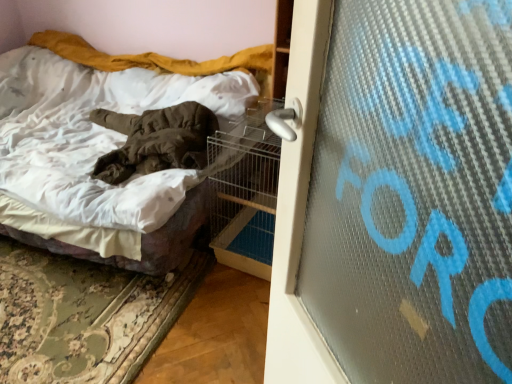
Question: From a real-world perspective, is white cotton bed at center positioned above or below metal wire birdcage at center?

Choices:
 (A) above
 (B) below

Answer: (A)

Question: Is point (90, 139) positioned closer to the camera than point (209, 168)?

Choices:
 (A) farther
 (B) closer

Answer: (A)

Question: Would you say white cotton bed at center is inside or outside metal wire birdcage at center?

Choices:
 (A) outside
 (B) inside

Answer: (A)

Question: Is metal wire birdcage at center taller or shorter than white cotton bed at center?

Choices:
 (A) short
 (B) tall

Answer: (B)

Question: From the image's perspective, is metal wire birdcage at center above or below white cotton bed at center?

Choices:
 (A) below
 (B) above

Answer: (A)

Question: Relative to white cotton bed at center, is metal wire birdcage at center in front or behind?

Choices:
 (A) front
 (B) behind

Answer: (B)

Question: Would you say metal wire birdcage at center is to the left or to the right of white cotton bed at center in the picture?

Choices:
 (A) right
 (B) left

Answer: (A)